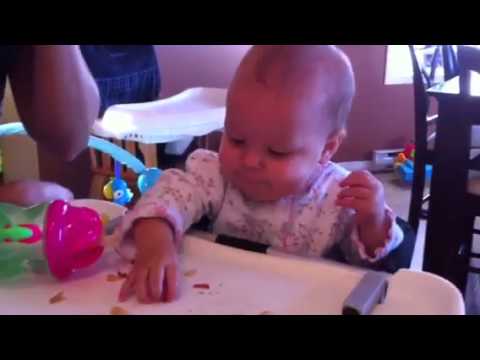
The height and width of the screenshot is (360, 480). What are the coordinates of `wall` in the screenshot? It's located at (376, 107), (193, 65).